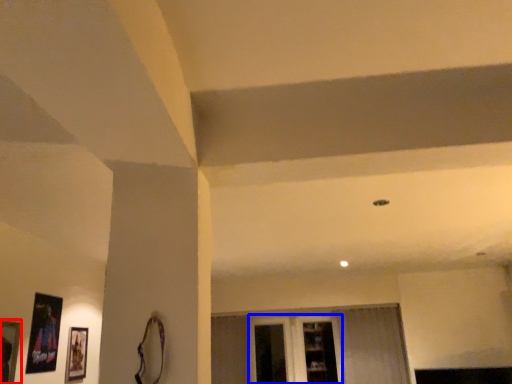
Question: Among these objects, which one is farthest to the camera, picture frame (highlighted by a red box) or glass door (highlighted by a blue box)?

Choices:
 (A) picture frame
 (B) glass door

Answer: (B)